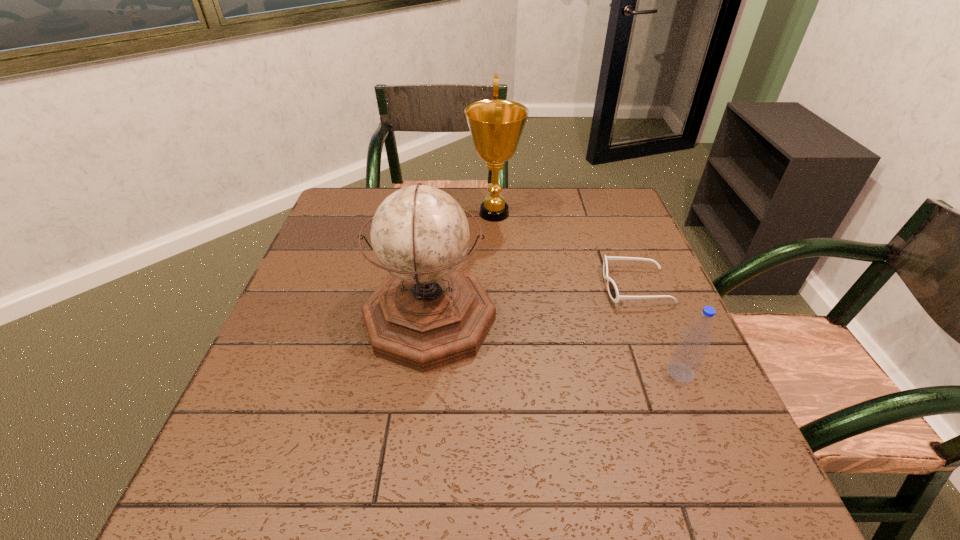
Image resolution: width=960 pixels, height=540 pixels. In order to click on vacant area at the near right corner of the desktop in this screenshot , I will do `click(735, 501)`.

In order to click on vacant point located between the shortest object and the water bottle in this screenshot , I will do `click(659, 329)`.

Where is `vacant region between the award and the third tallest object`? Image resolution: width=960 pixels, height=540 pixels. vacant region between the award and the third tallest object is located at coordinates (588, 293).

At what (x,y) coordinates should I click in order to perform the action: click on vacant region between the water bottle and the globe. Please return your answer as a coordinate pair (x, y). The height and width of the screenshot is (540, 960). Looking at the image, I should click on (555, 346).

At what (x,y) coordinates should I click in order to perform the action: click on empty space between the second shortest object and the sunglasses. Please return your answer as a coordinate pair (x, y). This screenshot has height=540, width=960. Looking at the image, I should click on (659, 329).

The height and width of the screenshot is (540, 960). Identify the location of free point between the third tallest object and the shortest object. (659, 329).

You are a GUI agent. You are given a task and a screenshot of the screen. Output one action in this format:
    pyautogui.click(x=<x>, y=<y>)
    Task: Click on the empty space that is in between the water bottle and the globe
    The height and width of the screenshot is (540, 960).
    Given the screenshot: What is the action you would take?
    pyautogui.click(x=555, y=346)

You are a GUI agent. You are given a task and a screenshot of the screen. Output one action in this format:
    pyautogui.click(x=<x>, y=<y>)
    Task: Click on the vacant space that is in between the farthest object and the water bottle
    The image size is (960, 540).
    Given the screenshot: What is the action you would take?
    pyautogui.click(x=588, y=293)

Where is `free spot between the farthest object and the water bottle`? This screenshot has height=540, width=960. free spot between the farthest object and the water bottle is located at coordinates [x=588, y=293].

The height and width of the screenshot is (540, 960). I want to click on free spot between the award and the sunglasses, so click(x=565, y=250).